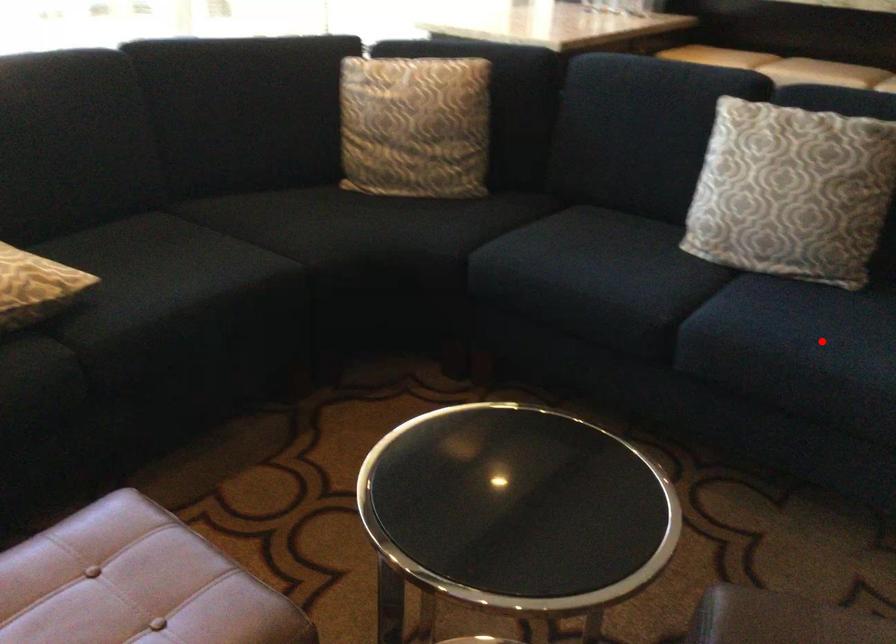
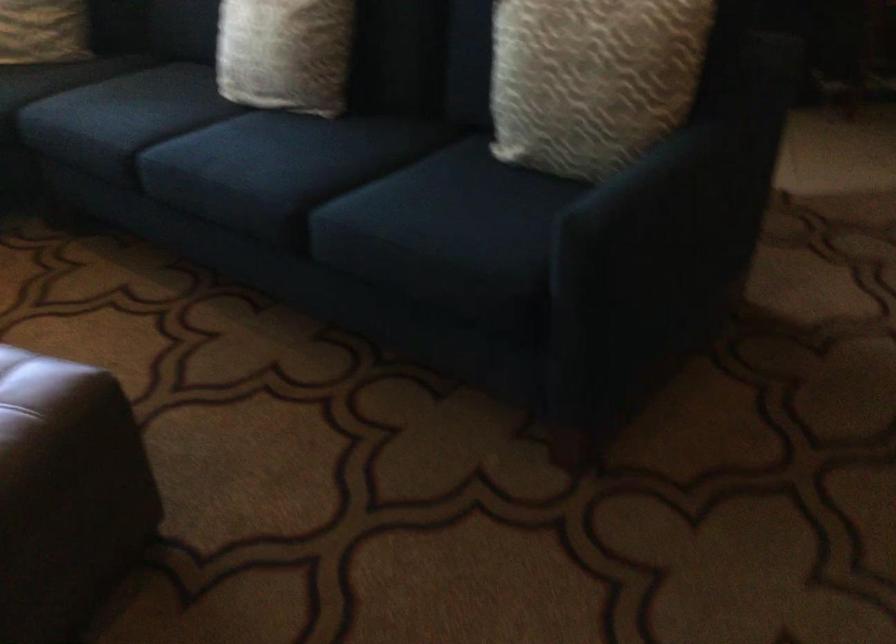
Question: A red point is marked in image1. In image2, is the corresponding 3D point closer to the camera or farther? Reply with the corresponding letter.

Choices:
 (A) The corresponding 3D point is closer.
 (B) The corresponding 3D point is farther.

Answer: (B)